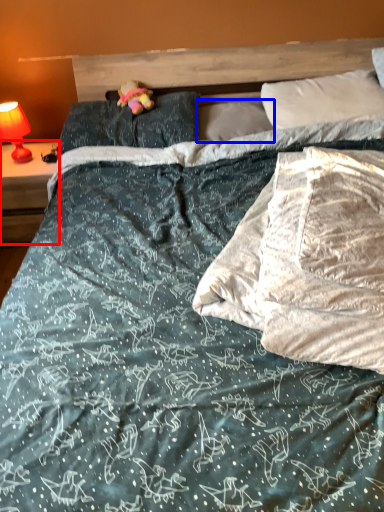
Question: Which object appears farthest to the camera in this image, nightstand (highlighted by a red box) or pillow (highlighted by a blue box)?

Choices:
 (A) nightstand
 (B) pillow

Answer: (A)